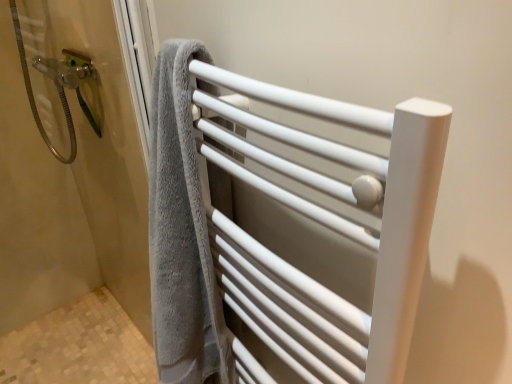
The width and height of the screenshot is (512, 384). Describe the element at coordinates (271, 241) in the screenshot. I see `white matte towel rack at center` at that location.

Locate an element on the screen. white matte towel rack at center is located at coordinates click(271, 241).

Measure the distance between gray towel at left and camera.

gray towel at left is 93.73 centimeters away from camera.

Identify the location of gray towel at left. Image resolution: width=512 pixels, height=384 pixels. (70, 177).

Describe the element at coordinates (70, 177) in the screenshot. I see `gray towel at left` at that location.

This screenshot has height=384, width=512. In order to click on white matte towel rack at center in this screenshot , I will do `click(271, 241)`.

Does white matte towel rack at center appear on the right side of gray towel at left?

Yes.

Considering their positions, is white matte towel rack at center located in front of or behind gray towel at left?

In the image, white matte towel rack at center appears in front of gray towel at left.

Between point (319, 339) and point (105, 94), which one is positioned in front?

The point (319, 339) is more forward.

From the image's perspective, which one is positioned lower, white matte towel rack at center or gray towel at left?

white matte towel rack at center.

From a real-world perspective, which object rests below the other?

From a 3D spatial view, gray towel at left is below.

Is white matte towel rack at center wider or thinner than gray towel at left?

Clearly, white matte towel rack at center has more width compared to gray towel at left.

Does white matte towel rack at center have a lesser height compared to gray towel at left?

Yes.

Does white matte towel rack at center have a smaller size compared to gray towel at left?

Actually, white matte towel rack at center might be larger than gray towel at left.

Can we say white matte towel rack at center lies outside gray towel at left?

Yes, white matte towel rack at center is not within gray towel at left.

Is white matte towel rack at center directly adjacent to gray towel at left?

No, white matte towel rack at center is not in contact with gray towel at left.

Is white matte towel rack at center oriented away from gray towel at left?

That's not correct — white matte towel rack at center is not looking away from gray towel at left.

Consider the image. What's the angular difference between white matte towel rack at center and gray towel at left's facing directions?

89.6 degrees separate the facing orientations of white matte towel rack at center and gray towel at left.

Based on the photo, measure the distance from white matte towel rack at center to gray towel at left.

white matte towel rack at center is 67.39 centimeters away from gray towel at left.

What are the coordinates of `towel rack lying on the right of gray towel at left` in the screenshot? It's located at (271, 241).

Is gray towel at left at the right side of white matte towel rack at center?

In fact, gray towel at left is to the left of white matte towel rack at center.

Consider the image. Which object is further away from the camera taking this photo, gray towel at left or white matte towel rack at center?

gray towel at left.

Which is behind, point (106, 107) or point (177, 241)?

The point (106, 107) is more distant.

From the image's perspective, would you say gray towel at left is shown under white matte towel rack at center?

No, from the image's perspective, gray towel at left is not beneath white matte towel rack at center.

From a real-world perspective, is gray towel at left physically above white matte towel rack at center?

No.

From the picture: Between gray towel at left and white matte towel rack at center, which one has smaller width?

gray towel at left.

Considering the sizes of objects gray towel at left and white matte towel rack at center in the image provided, who is taller, gray towel at left or white matte towel rack at center?

With more height is gray towel at left.

Which of these two, gray towel at left or white matte towel rack at center, is smaller?

With smaller size is gray towel at left.

Looking at this image, is gray towel at left not inside white matte towel rack at center?

Yes, gray towel at left is not within white matte towel rack at center.

Is gray towel at left next to white matte towel rack at center and touching it?

gray towel at left and white matte towel rack at center are clearly separated.

Does gray towel at left turn towards white matte towel rack at center?

Yes, gray towel at left is facing white matte towel rack at center.

How different are the orientations of gray towel at left and white matte towel rack at center in degrees?

The facing directions of gray towel at left and white matte towel rack at center are 89.6 degrees apart.

Based on the photo, measure the distance between gray towel at left and white matte towel rack at center.

gray towel at left is 26.53 inches away from white matte towel rack at center.

Where is `towel rack below the gray towel at left (from the image's perspective)`? This screenshot has width=512, height=384. towel rack below the gray towel at left (from the image's perspective) is located at coordinates (271, 241).

Image resolution: width=512 pixels, height=384 pixels. What are the coordinates of `towel rack in front of the gray towel at left` in the screenshot? It's located at (271, 241).

At what (x,y) coordinates should I click in order to perform the action: click on screen door that is above the white matte towel rack at center (from the image's perspective). Please return your answer as a coordinate pair (x, y). Looking at the image, I should click on [70, 177].